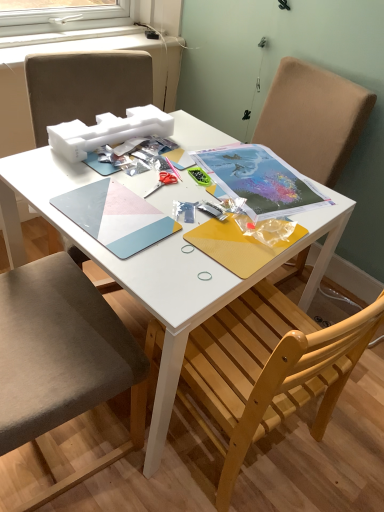
Image resolution: width=384 pixels, height=512 pixels. Find the location of `free space in front of matte plastic notebook at center, which ranks as the 1th notebook in left-to-right order`. free space in front of matte plastic notebook at center, which ranks as the 1th notebook in left-to-right order is located at coordinates (137, 271).